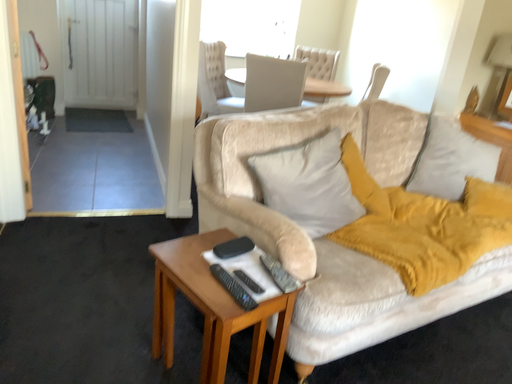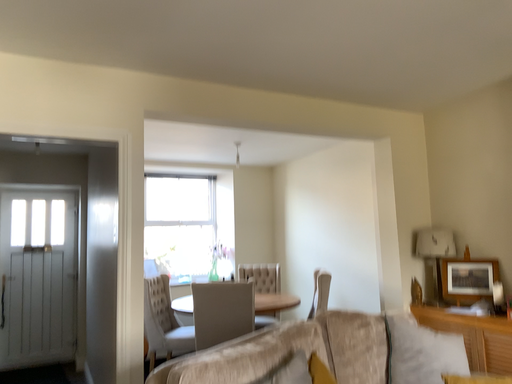
Question: How did the camera likely rotate when shooting the video?

Choices:
 (A) rotated downward
 (B) rotated upward

Answer: (B)